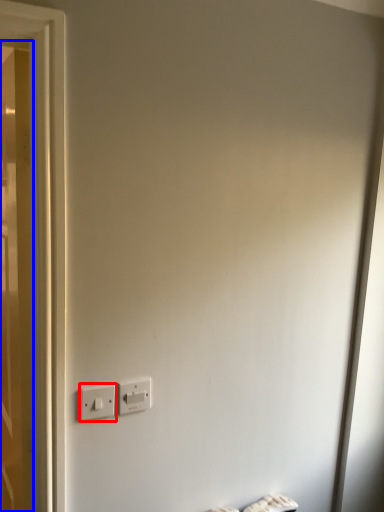
Question: Which point is further to the camera, power plugs and sockets (highlighted by a red box) or door (highlighted by a blue box)?

Choices:
 (A) power plugs and sockets
 (B) door

Answer: (A)